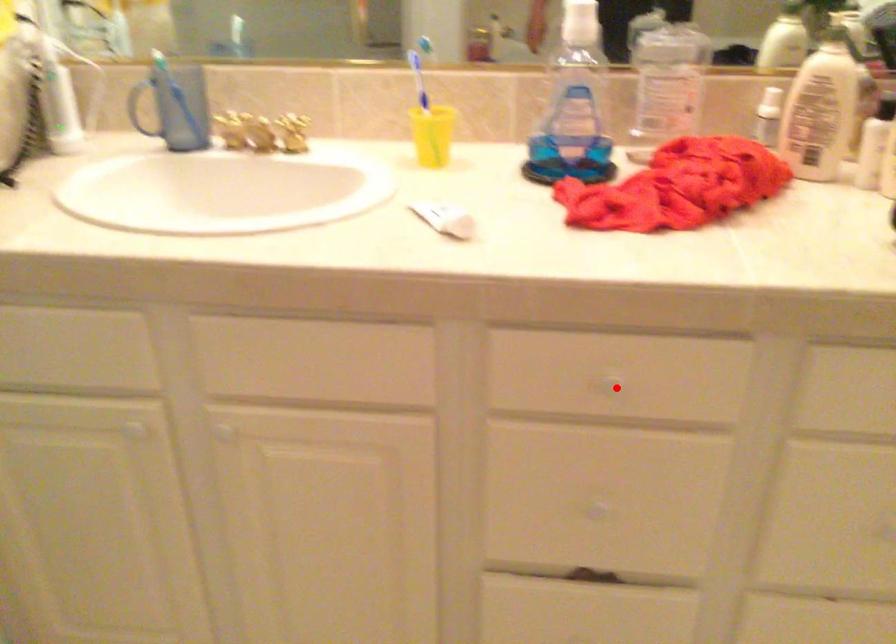
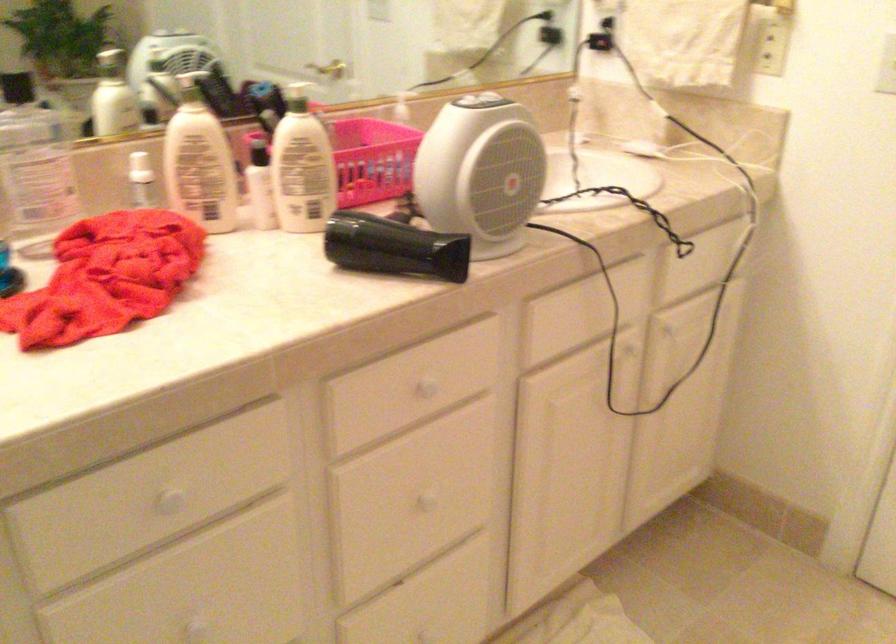
Where in the second image is the point corresponding to the highlighted location from the first image?

(169, 500)